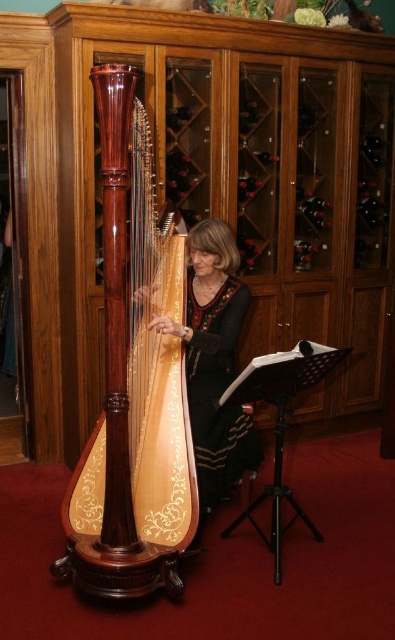
Question: Where is polished wood harp at center located in relation to wooden harp at center in the image?

Choices:
 (A) below
 (B) above

Answer: (B)

Question: Among these points, which one is farthest from the camera?

Choices:
 (A) (199, 488)
 (B) (116, 236)

Answer: (A)

Question: Which object appears farthest from the camera in this image?

Choices:
 (A) wooden harp at center
 (B) polished wood harp at center

Answer: (A)

Question: From the image, what is the correct spatial relationship of polished wood harp at center in relation to wooden harp at center?

Choices:
 (A) right
 (B) left

Answer: (B)

Question: Is polished wood harp at center wider than wooden harp at center?

Choices:
 (A) yes
 (B) no

Answer: (B)